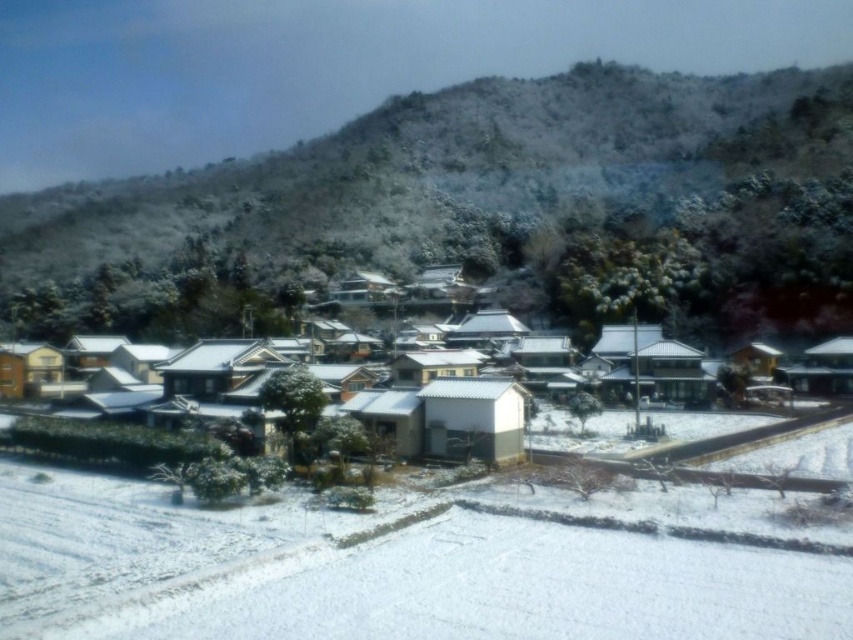
Question: In this image, where is snow-covered trees at upper center located relative to white matte houses at center?

Choices:
 (A) left
 (B) right

Answer: (A)

Question: Which object appears farthest from the camera in this image?

Choices:
 (A) snow-covered trees at upper center
 (B) white matte houses at center

Answer: (A)

Question: Can you confirm if snow-covered trees at upper center is positioned to the left of white matte houses at center?

Choices:
 (A) no
 (B) yes

Answer: (B)

Question: Is the position of snow-covered trees at upper center more distant than that of white matte houses at center?

Choices:
 (A) yes
 (B) no

Answer: (A)

Question: Which object is closer to the camera taking this photo?

Choices:
 (A) white matte houses at center
 (B) snow-covered trees at upper center

Answer: (A)

Question: Which point appears farthest from the camera in this image?

Choices:
 (A) (138, 289)
 (B) (556, 173)

Answer: (B)